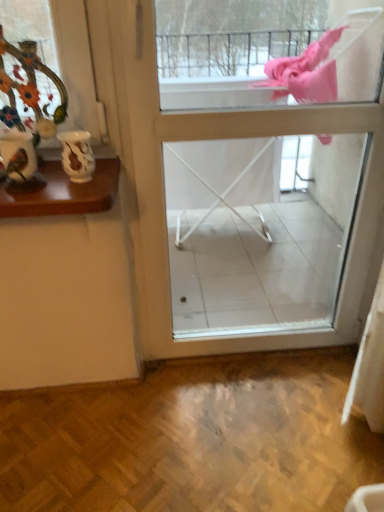
Question: In the image, is white glossy screen door at center on the left side or the right side of white glossy vase at upper left?

Choices:
 (A) right
 (B) left

Answer: (A)

Question: From a real-world perspective, is white glossy screen door at center physically located above or below white glossy vase at upper left?

Choices:
 (A) below
 (B) above

Answer: (A)

Question: Which of these objects is positioned closest to the white glossy screen door at center?

Choices:
 (A) white glossy vase at upper left
 (B) porcelain vase at upper left

Answer: (B)

Question: Which object is the farthest from the porcelain vase at upper left?

Choices:
 (A) white glossy screen door at center
 (B) white glossy vase at upper left

Answer: (A)